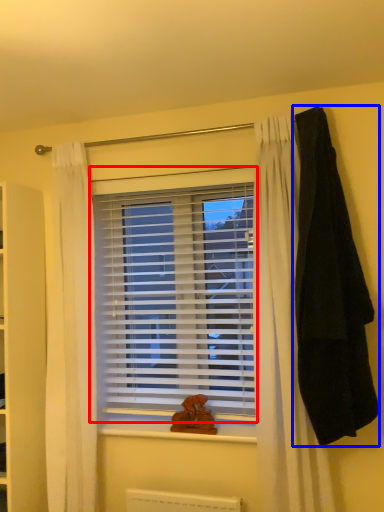
Question: Which point is further to the camera, window blind (highlighted by a red box) or blanket (highlighted by a blue box)?

Choices:
 (A) window blind
 (B) blanket

Answer: (A)